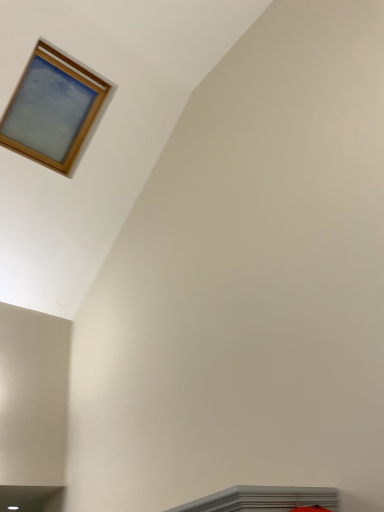
The image size is (384, 512). Describe the element at coordinates (52, 109) in the screenshot. I see `wooden picture frame at upper left` at that location.

Locate an element on the screen. The height and width of the screenshot is (512, 384). wooden picture frame at upper left is located at coordinates (52, 109).

Where is `wooden picture frame at upper left`? This screenshot has width=384, height=512. wooden picture frame at upper left is located at coordinates (52, 109).